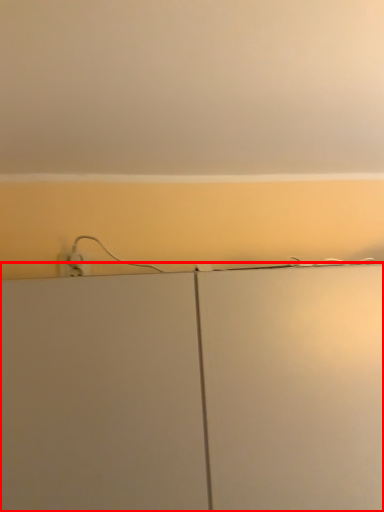
Question: From the image's perspective, where is cabinetry (annotated by the red box) located in relation to backdrop in the image?

Choices:
 (A) below
 (B) above

Answer: (A)